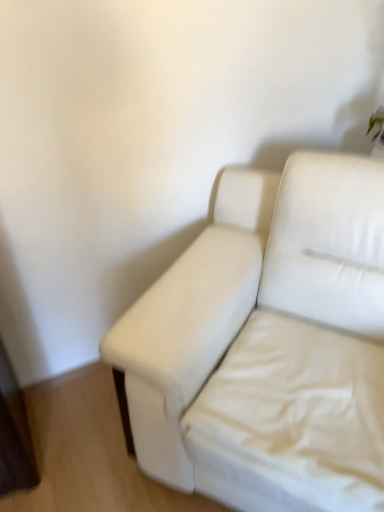
This screenshot has width=384, height=512. I want to click on white fabric sheet at lower right, so click(291, 420).

This screenshot has height=512, width=384. Describe the element at coordinates (291, 420) in the screenshot. I see `white fabric sheet at lower right` at that location.

What do you see at coordinates (269, 350) in the screenshot? This screenshot has width=384, height=512. I see `white fabric couch at center` at bounding box center [269, 350].

What is the approximate height of white fabric couch at center?

It is 35.00 inches.

Identify the location of white fabric couch at center. (269, 350).

I want to click on white fabric sheet at lower right, so click(x=291, y=420).

Can you confirm if white fabric sheet at lower right is positioned to the right of white fabric couch at center?

Yes.

Which object is more forward, white fabric sheet at lower right or white fabric couch at center?

Positioned in front is white fabric couch at center.

Is point (259, 360) closer or farther from the camera than point (213, 456)?

Point (259, 360) appears to be farther away from the viewer than point (213, 456).

From the image's perspective, is white fabric sheet at lower right located above or below white fabric couch at center?

white fabric sheet at lower right is situated lower than white fabric couch at center in the image.

From a real-world perspective, which is physically above, white fabric sheet at lower right or white fabric couch at center?

From a 3D spatial view, white fabric couch at center is above.

Considering the sizes of objects white fabric sheet at lower right and white fabric couch at center in the image provided, who is thinner, white fabric sheet at lower right or white fabric couch at center?

white fabric sheet at lower right.

Considering the sizes of objects white fabric sheet at lower right and white fabric couch at center in the image provided, who is shorter, white fabric sheet at lower right or white fabric couch at center?

white fabric sheet at lower right.

Is white fabric sheet at lower right bigger than white fabric couch at center?

No.

Would you say white fabric sheet at lower right contains white fabric couch at center?

Definitely not — white fabric couch at center is not inside white fabric sheet at lower right.

Is white fabric sheet at lower right with white fabric couch at center?

Yes, the surface of white fabric sheet at lower right is in contact with white fabric couch at center.

Is white fabric sheet at lower right facing away from white fabric couch at center?

Yes, white fabric sheet at lower right is facing away from white fabric couch at center.

Find the location of a particular element. Image resolution: width=384 pixels, height=512 pixels. sheet directly beneath the white fabric couch at center (from a real-world perspective) is located at coordinates [291, 420].

Can you confirm if white fabric couch at center is positioned to the left of white fabric sheet at lower right?

Yes.

Considering their positions, is white fabric couch at center located in front of or behind white fabric sheet at lower right?

white fabric couch at center is in front of white fabric sheet at lower right.

Looking at this image, which is farther from the camera, (235,249) or (192,406)?

Point (235,249)

From the image's perspective, which is above, white fabric couch at center or white fabric sheet at lower right?

white fabric couch at center.

From a real-world perspective, which object rests below the other?

white fabric sheet at lower right is physically lower.

Between white fabric couch at center and white fabric sheet at lower right, which one has larger width?

Wider between the two is white fabric couch at center.

Which of these two, white fabric couch at center or white fabric sheet at lower right, stands shorter?

white fabric sheet at lower right.

Considering the relative sizes of white fabric couch at center and white fabric sheet at lower right in the image provided, is white fabric couch at center bigger than white fabric sheet at lower right?

Yes, white fabric couch at center is bigger than white fabric sheet at lower right.

Is white fabric couch at center inside the boundaries of white fabric sheet at lower right, or outside?

white fabric couch at center is not enclosed by white fabric sheet at lower right.

Is white fabric couch at center next to white fabric sheet at lower right and touching it?

Yes.

Is white fabric couch at center oriented away from white fabric sheet at lower right?

Yes.

The image size is (384, 512). Identify the location of sheet below the white fabric couch at center (from a real-world perspective). (291, 420).

Where is `studio couch above the white fabric sheet at lower right (from the image's perspective)`? studio couch above the white fabric sheet at lower right (from the image's perspective) is located at coordinates (269, 350).

The height and width of the screenshot is (512, 384). Find the location of `studio couch to the left of white fabric sheet at lower right`. studio couch to the left of white fabric sheet at lower right is located at coordinates (269, 350).